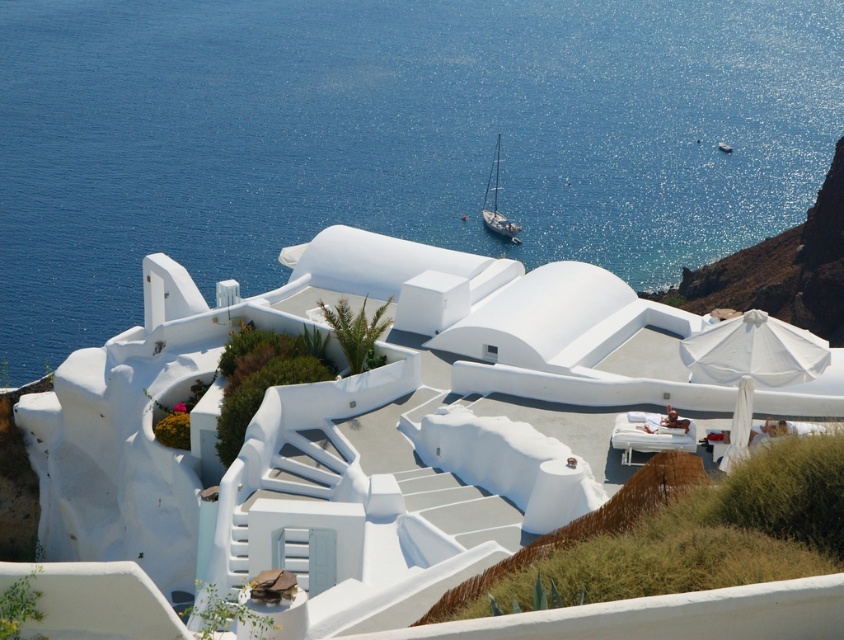
Between point (112, 49) and point (495, 144), which one is positioned behind?

Positioned behind is point (112, 49).

Does blue water at center appear over blue glossy sailboat at center?

Yes, blue water at center is above blue glossy sailboat at center.

Locate an element on the screen. The height and width of the screenshot is (640, 844). blue water at center is located at coordinates (390, 138).